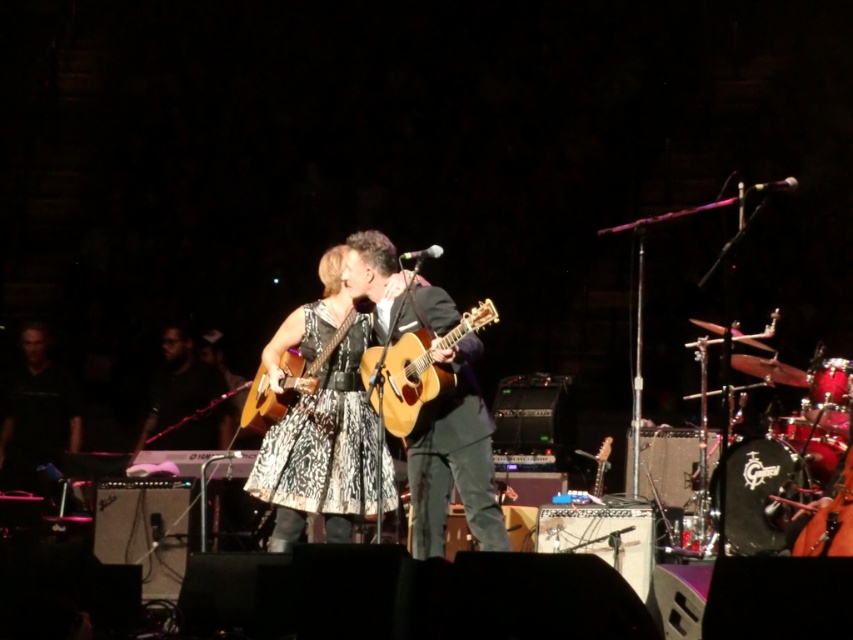
You are a stagehand setting up a new microphone stand between the matte brown acoustic guitar at center and the black textured shirt at center. Since the stand requires 30 cm of space, can you fit it between them?

The matte brown acoustic guitar at center is smaller than the black textured shirt at center, but the description does not provide specific measurements between them. Therefore, it is unclear if there is enough space to fit the microphone stand.

You are a photographer positioned at the front of the stage. You want to capture a closeup shot of the printed fabric dress at center. Considering the dress is 31.69 feet away from you, is this distance within the standard autofocus range of most professional DSLR cameras?

The printed fabric dress at center is 31.69 feet from the viewer. Most professional DSLR cameras have an autofocus range that can handle distances up to 30 feet or more, so it should be possible to focus on the dress at this distance.